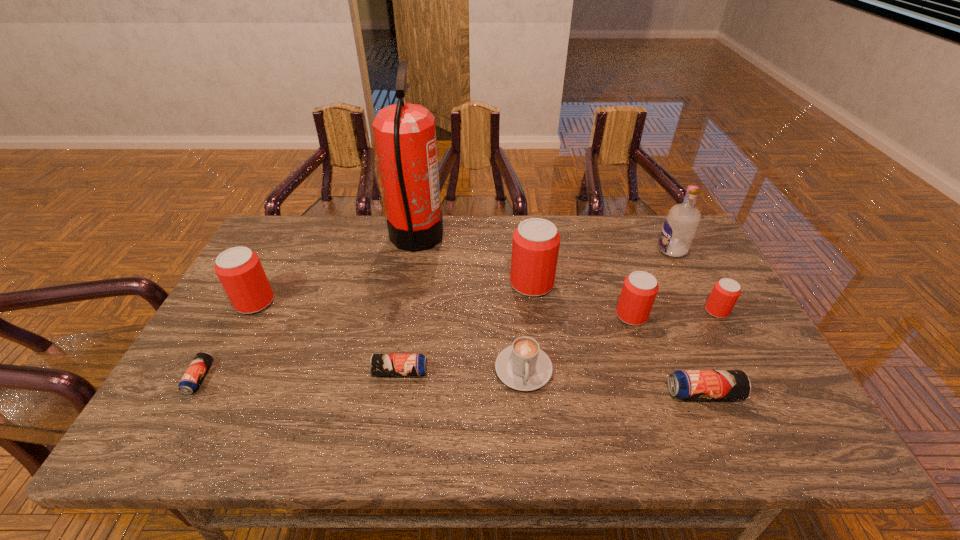
Find the location of `fire extinguisher situated at the far edge`. fire extinguisher situated at the far edge is located at coordinates (405, 135).

The width and height of the screenshot is (960, 540). What are the coordinates of `vodka that is positioned at the far edge` in the screenshot? It's located at pos(681,223).

Where is `vodka located in the right edge section of the desktop`? vodka located in the right edge section of the desktop is located at coordinates (681, 223).

At what (x,y) coordinates should I click in order to perform the action: click on object located in the far right corner section of the desktop. Please return your answer as a coordinate pair (x, y). The width and height of the screenshot is (960, 540). Looking at the image, I should click on (681, 223).

You are a GUI agent. You are given a task and a screenshot of the screen. Output one action in this format:
    pyautogui.click(x=<x>, y=<y>)
    Task: Click on the vacant space at the far edge of the desktop
    The width and height of the screenshot is (960, 540).
    Given the screenshot: What is the action you would take?
    pyautogui.click(x=372, y=259)

You are a GUI agent. You are given a task and a screenshot of the screen. Output one action in this format:
    pyautogui.click(x=<x>, y=<y>)
    Task: Click on the free region at the near edge
    The width and height of the screenshot is (960, 540).
    Given the screenshot: What is the action you would take?
    click(300, 417)

At what (x,y) coordinates should I click in order to perform the action: click on free region at the left edge of the desktop. Please return your answer as a coordinate pair (x, y). Looking at the image, I should click on (221, 315).

Identify the location of vacant region at the right edge of the desktop. The width and height of the screenshot is (960, 540). (718, 353).

The width and height of the screenshot is (960, 540). I want to click on free spot between the second shortest beer can and the leftmost red beer can, so click(x=327, y=337).

You are a GUI agent. You are given a task and a screenshot of the screen. Output one action in this format:
    pyautogui.click(x=<x>, y=<y>)
    Task: Click on the free space that is in between the vodka and the third tallest object
    
    Given the screenshot: What is the action you would take?
    pyautogui.click(x=602, y=267)